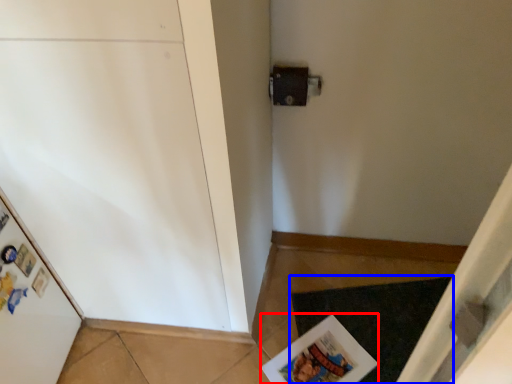
Question: Among these objects, which one is farthest to the camera, magazine (highlighted by a red box) or doormat (highlighted by a blue box)?

Choices:
 (A) magazine
 (B) doormat

Answer: (B)